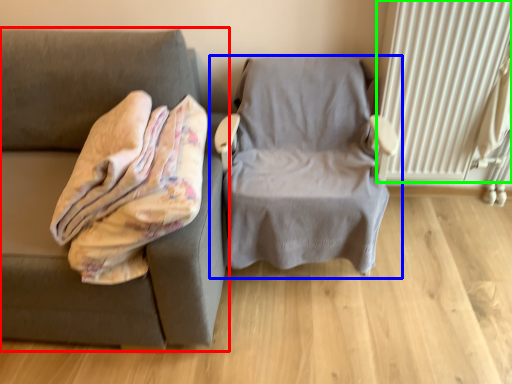
Question: Which object is the farthest from studio couch (highlighted by a red box)? Choose among these: chair (highlighted by a blue box) or radiator (highlighted by a green box).

Choices:
 (A) chair
 (B) radiator

Answer: (B)